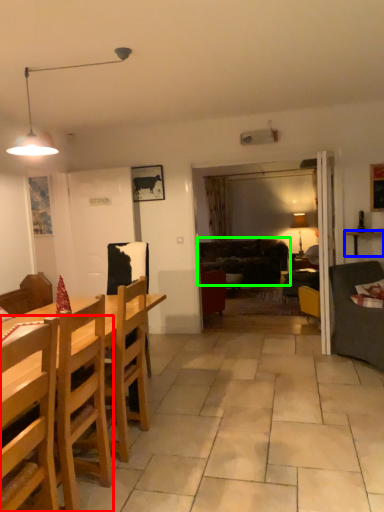
Question: Based on their relative distances, which object is nearer to chair (highlighted by a red box)? Choose from cabinetry (highlighted by a blue box) and studio couch (highlighted by a green box).

Choices:
 (A) cabinetry
 (B) studio couch

Answer: (A)